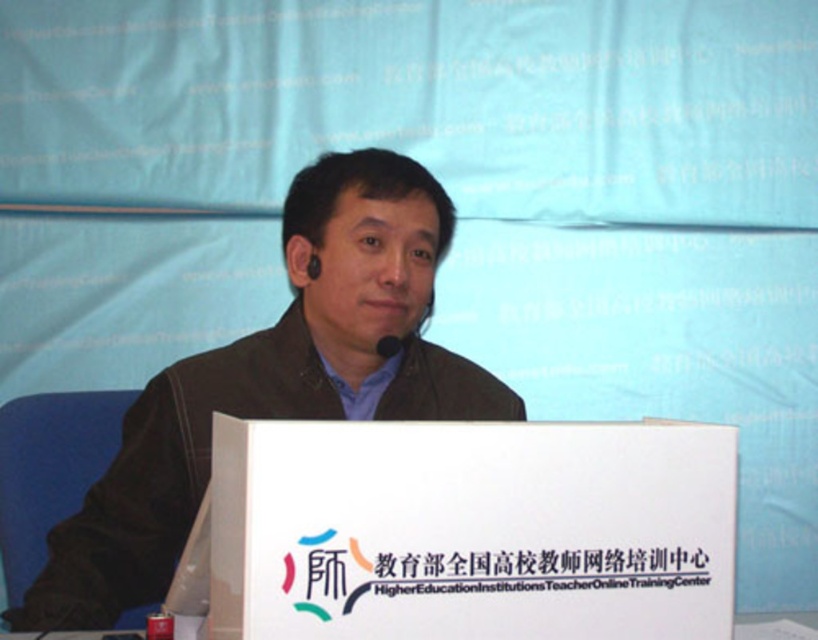
Question: Which of the following is the farthest from the observer?

Choices:
 (A) black matte microphone at center
 (B) white paper at center
 (C) matte black jacket at center

Answer: (A)

Question: Which object is the closest to the black matte microphone at center?

Choices:
 (A) white paper at center
 (B) white cardboard box at center
 (C) matte black jacket at center

Answer: (C)

Question: Can you confirm if matte black jacket at center is positioned to the right of black matte microphone at center?

Choices:
 (A) yes
 (B) no

Answer: (B)

Question: Is white paper at center below black matte microphone at center?

Choices:
 (A) no
 (B) yes

Answer: (B)

Question: Estimate the real-world distances between objects in this image. Which object is closer to the white cardboard box at center?

Choices:
 (A) matte black jacket at center
 (B) black matte microphone at center
 (C) white paper at center

Answer: (C)

Question: Is the position of white paper at center more distant than that of black matte microphone at center?

Choices:
 (A) yes
 (B) no

Answer: (B)